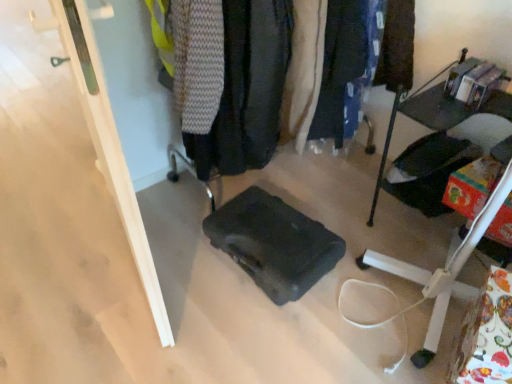
The height and width of the screenshot is (384, 512). In order to click on free point in front of dark gray fabric at center in this screenshot , I will do `click(246, 290)`.